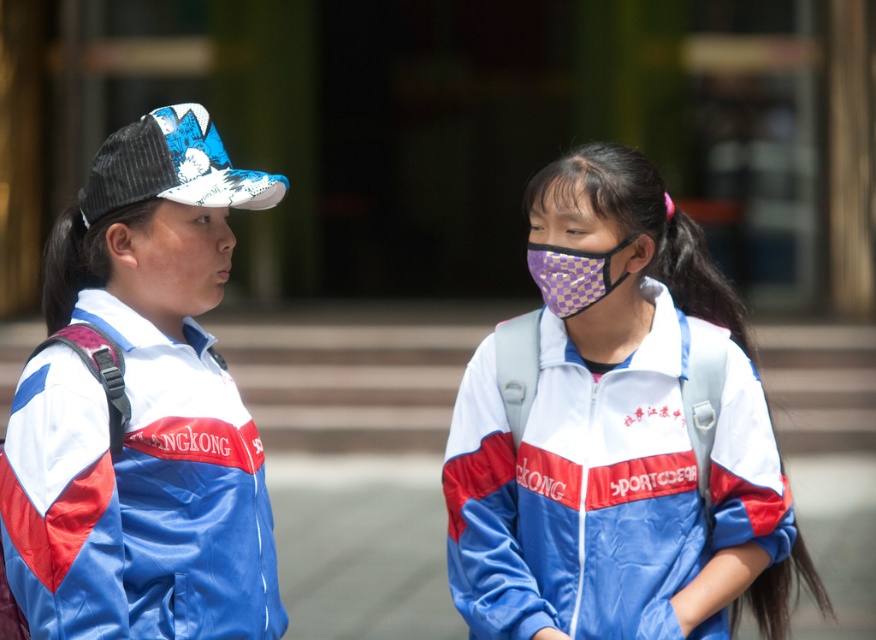
The image size is (876, 640). What do you see at coordinates (616, 435) in the screenshot?
I see `purple checkered fabric mask at center` at bounding box center [616, 435].

Who is more distant from viewer, (612, 308) or (217, 140)?

Point (612, 308)

The width and height of the screenshot is (876, 640). In order to click on purple checkered fabric mask at center in this screenshot , I will do `click(616, 435)`.

The image size is (876, 640). Identify the location of purple checkered fabric mask at center. (616, 435).

Can you confirm if purple checkered fabric mask at center is smaller than purple checkered mask at center?

No.

Between purple checkered fabric mask at center and purple checkered mask at center, which one has less height?

purple checkered mask at center is shorter.

In order to click on purple checkered fabric mask at center in this screenshot , I will do `click(616, 435)`.

Does matte blue jacket at left have a smaller size compared to purple checkered mask at center?

Actually, matte blue jacket at left might be larger than purple checkered mask at center.

Where is `matte blue jacket at left`? matte blue jacket at left is located at coordinates (142, 410).